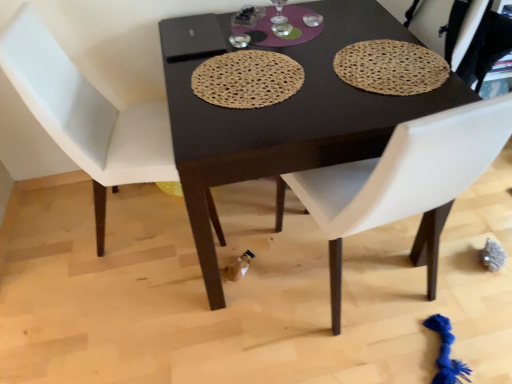
Question: Considering the relative sizes of brown woven placemat at upper right, placed as the 1th mat when sorted from right to left, and white leather chair at left, the 2th chair positioned from the right, in the image provided, is brown woven placemat at upper right, placed as the 1th mat when sorted from right to left, smaller than white leather chair at left, the 2th chair positioned from the right,?

Choices:
 (A) yes
 (B) no

Answer: (A)

Question: From the image's perspective, does brown woven placemat at upper right, the second mat viewed from the left, appear lower than white leather chair at left, the 2th chair positioned from the right?

Choices:
 (A) no
 (B) yes

Answer: (A)

Question: Is brown woven placemat at upper right, the second mat viewed from the left, shorter than white leather chair at left, arranged as the 1th chair when viewed from the left?

Choices:
 (A) yes
 (B) no

Answer: (A)

Question: Considering the relative sizes of brown woven placemat at upper right, placed as the 1th mat when sorted from right to left, and white leather chair at left, the 2th chair positioned from the right, in the image provided, is brown woven placemat at upper right, placed as the 1th mat when sorted from right to left, bigger than white leather chair at left, the 2th chair positioned from the right,?

Choices:
 (A) yes
 (B) no

Answer: (B)

Question: Does brown woven placemat at upper right, the second mat viewed from the left, appear on the left side of white leather chair at left, the 2th chair positioned from the right?

Choices:
 (A) no
 (B) yes

Answer: (A)

Question: Is brown woven placemat at upper right, placed as the 1th mat when sorted from right to left, looking in the opposite direction of white leather chair at left, arranged as the 1th chair when viewed from the left?

Choices:
 (A) no
 (B) yes

Answer: (A)

Question: Is white leather chair at center, the 1th chair in the right-to-left sequence, located outside brown woven placemat at upper right, placed as the 1th mat when sorted from right to left?

Choices:
 (A) no
 (B) yes

Answer: (B)

Question: Can you confirm if white leather chair at center, the 1th chair in the right-to-left sequence, is thinner than brown woven placemat at upper right, the second mat viewed from the left?

Choices:
 (A) yes
 (B) no

Answer: (B)

Question: Would you consider white leather chair at center, positioned as the second chair in left-to-right order, to be distant from brown woven placemat at upper right, placed as the 1th mat when sorted from right to left?

Choices:
 (A) no
 (B) yes

Answer: (A)

Question: Does white leather chair at center, the 1th chair in the right-to-left sequence, turn towards brown woven placemat at upper right, the second mat viewed from the left?

Choices:
 (A) yes
 (B) no

Answer: (A)

Question: Can you confirm if white leather chair at center, the 1th chair in the right-to-left sequence, is smaller than brown woven placemat at upper right, the second mat viewed from the left?

Choices:
 (A) no
 (B) yes

Answer: (A)

Question: From the image's perspective, is white leather chair at center, positioned as the second chair in left-to-right order, beneath brown woven placemat at upper right, the second mat viewed from the left?

Choices:
 (A) no
 (B) yes

Answer: (B)

Question: From a real-world perspective, is white leather chair at left, the 2th chair positioned from the right, on top of natural fiber placemat at center, which appears as the second mat when viewed from the right?

Choices:
 (A) yes
 (B) no

Answer: (B)